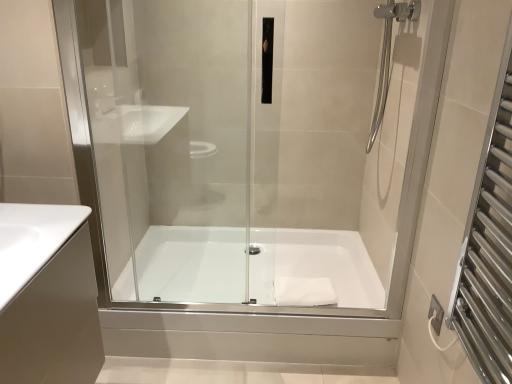
Identify the location of transparent glass shower door at center. Image resolution: width=512 pixels, height=384 pixels. (241, 152).

What do you see at coordinates (489, 246) in the screenshot? I see `silver metallic towel rack at right` at bounding box center [489, 246].

What are the coordinates of `white glossy bathtub at center` in the screenshot? It's located at (316, 264).

Locate an element on the screen. Image resolution: width=512 pixels, height=384 pixels. white glossy sink at lower left is located at coordinates (32, 240).

The image size is (512, 384). What do you see at coordinates (304, 291) in the screenshot?
I see `white matte towel at center` at bounding box center [304, 291].

Where is `transparent glass shower door at center`? The width and height of the screenshot is (512, 384). transparent glass shower door at center is located at coordinates (241, 152).

Is transparent glass shower door at center a part of silver metallic towel rack at right?

Actually, transparent glass shower door at center is outside silver metallic towel rack at right.

Can you confirm if silver metallic towel rack at right is positioned to the right of transparent glass shower door at center?

Yes.

Locate an element on the screen. This screenshot has height=384, width=512. shower door on the left side of silver metallic towel rack at right is located at coordinates (241, 152).

Is point (480, 337) less distant than point (161, 153)?

Yes, point (480, 337) is closer to viewer.

From the image's perspective, is white glossy sink at lower left beneath silver metallic towel rack at right?

Correct, white glossy sink at lower left appears lower than silver metallic towel rack at right in the image.

Do you think white glossy sink at lower left is within silver metallic towel rack at right, or outside of it?

white glossy sink at lower left is not inside silver metallic towel rack at right, it's outside.

Considering the relative positions of white glossy sink at lower left and silver metallic towel rack at right in the image provided, is white glossy sink at lower left to the left or to the right of silver metallic towel rack at right?

white glossy sink at lower left is positioned on silver metallic towel rack at right's left side.

How far apart are white glossy sink at lower left and silver metallic towel rack at right?

white glossy sink at lower left and silver metallic towel rack at right are 38.59 inches apart.

Considering the sizes of white glossy bathtub at center and white matte towel at center in the image, is white glossy bathtub at center bigger or smaller than white matte towel at center?

Clearly, white glossy bathtub at center is larger in size than white matte towel at center.

Considering the sizes of objects white glossy bathtub at center and white matte towel at center in the image provided, who is thinner, white glossy bathtub at center or white matte towel at center?

Thinner between the two is white matte towel at center.

Which is correct: white glossy bathtub at center is inside white matte towel at center, or outside of it?

The correct answer is: outside.

Is white glossy bathtub at center next to transparent glass shower door at center?

No, white glossy bathtub at center is not touching transparent glass shower door at center.

Can you tell me how much white glossy bathtub at center and transparent glass shower door at center differ in facing direction?

The angle between the facing direction of white glossy bathtub at center and the facing direction of transparent glass shower door at center is 1.02 degrees.

Which is in front, point (352, 233) or point (272, 253)?

Positioned in front is point (272, 253).

Based on the photo, is white glossy bathtub at center surrounded by transparent glass shower door at center?

No, transparent glass shower door at center does not contain white glossy bathtub at center.

Considering the relative sizes of transparent glass shower door at center and white glossy bathtub at center in the image provided, is transparent glass shower door at center taller than white glossy bathtub at center?

Yes, transparent glass shower door at center is taller than white glossy bathtub at center.

From a real-world perspective, is transparent glass shower door at center positioned above or below white glossy bathtub at center?

transparent glass shower door at center is above white glossy bathtub at center.

From a real-world perspective, who is located lower, silver metallic towel rack at right or white glossy sink at lower left?

From a 3D spatial view, white glossy sink at lower left is below.

Can you confirm if silver metallic towel rack at right is thinner than white glossy sink at lower left?

Indeed, silver metallic towel rack at right has a lesser width compared to white glossy sink at lower left.

In the image, is silver metallic towel rack at right positioned in front of or behind white glossy sink at lower left?

In the image, silver metallic towel rack at right appears in front of white glossy sink at lower left.

The width and height of the screenshot is (512, 384). In order to click on screen door above the white glossy sink at lower left (from a real-world perspective) in this screenshot , I will do `click(489, 246)`.

Can you confirm if white matte towel at center is positioned to the left of silver metallic towel rack at right?

Correct, you'll find white matte towel at center to the left of silver metallic towel rack at right.

Is white matte towel at center oriented away from silver metallic towel rack at right?

No, white matte towel at center's orientation is not away from silver metallic towel rack at right.

Is the surface of white matte towel at center in direct contact with silver metallic towel rack at right?

white matte towel at center is not next to silver metallic towel rack at right, and they're not touching.

From the picture: Which object is wider, white matte towel at center or silver metallic towel rack at right?

white matte towel at center is wider.

Where is `screen door that is below the transparent glass shower door at center (from the image's perspective)`? This screenshot has width=512, height=384. screen door that is below the transparent glass shower door at center (from the image's perspective) is located at coordinates (489, 246).

Where is `screen door on the right of white glossy sink at lower left`? This screenshot has width=512, height=384. screen door on the right of white glossy sink at lower left is located at coordinates (489, 246).

Looking at the image, which one is located closer to white matte towel at center, white glossy bathtub at center or silver metallic towel rack at right?

white glossy bathtub at center lies closer to white matte towel at center than the other object.

Looking at the image, which one is located closer to white glossy sink at lower left, white matte towel at center or white glossy bathtub at center?

white glossy bathtub at center is positioned closer to the anchor white glossy sink at lower left.

Based on their spatial positions, is white glossy bathtub at center or white matte towel at center further from white glossy sink at lower left?

Based on the image, white matte towel at center appears to be further to white glossy sink at lower left.

From the image, which object appears to be nearer to transparent glass shower door at center, silver metallic towel rack at right or white glossy sink at lower left?

The object closer to transparent glass shower door at center is white glossy sink at lower left.

Looking at the image, which one is located closer to silver metallic towel rack at right, white glossy sink at lower left or white matte towel at center?

The object closer to silver metallic towel rack at right is white matte towel at center.

Considering their positions, is silver metallic towel rack at right positioned further to white glossy sink at lower left than white matte towel at center?

The object further to white glossy sink at lower left is white matte towel at center.

Which object lies further to the anchor point white glossy sink at lower left, transparent glass shower door at center or white matte towel at center?

white matte towel at center.

Which object lies further to the anchor point white matte towel at center, silver metallic towel rack at right or white glossy sink at lower left?

The object further to white matte towel at center is white glossy sink at lower left.

In order to click on bathtub positioned between silver metallic towel rack at right and white matte towel at center from near to far in this screenshot , I will do point(316,264).

Identify the location of counter top positioned between silver metallic towel rack at right and white glossy bathtub at center from near to far. This screenshot has width=512, height=384. tap(32, 240).

The image size is (512, 384). Identify the location of shower door between white glossy sink at lower left and silver metallic towel rack at right. (241, 152).

Identify the location of bathtub positioned between transparent glass shower door at center and white matte towel at center from near to far. (316, 264).